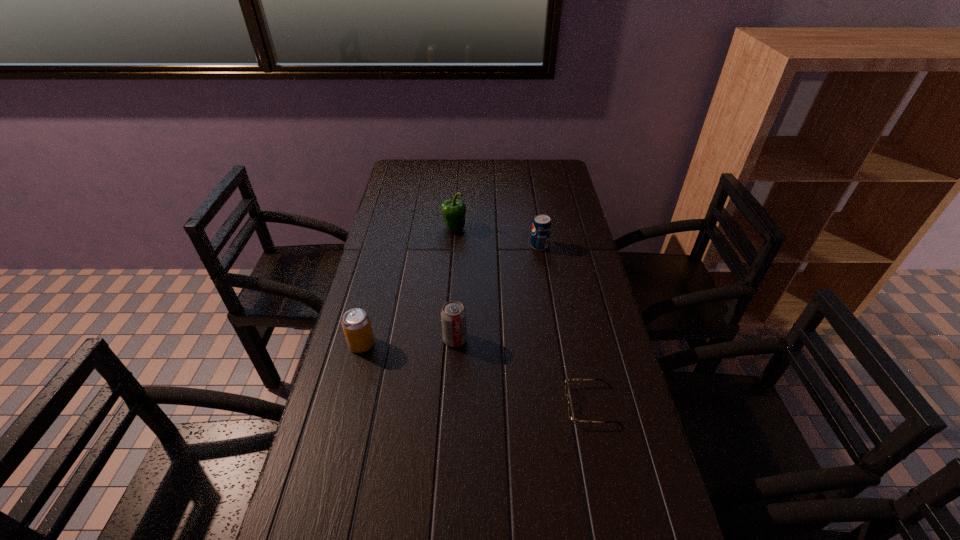
The height and width of the screenshot is (540, 960). I want to click on bell pepper, so click(453, 211).

Locate an element on the screen. Image resolution: width=960 pixels, height=540 pixels. the farthest object is located at coordinates (453, 211).

What are the coordinates of `the second pop (soda) from right to left` in the screenshot? It's located at (453, 315).

Find the location of a particular element. the fourth nearest object is located at coordinates (541, 227).

The height and width of the screenshot is (540, 960). I want to click on the rightmost pop (soda), so click(x=541, y=227).

Identify the location of the leftmost object. The width and height of the screenshot is (960, 540). (356, 324).

This screenshot has height=540, width=960. I want to click on the nearest object, so click(570, 409).

This screenshot has width=960, height=540. In order to click on the shortest object in this screenshot , I will do `click(570, 409)`.

Locate an element on the screen. free space located on the right of the bell pepper is located at coordinates (547, 228).

Identify the location of free point located on the back of the second pop (soda) from left to right. (456, 317).